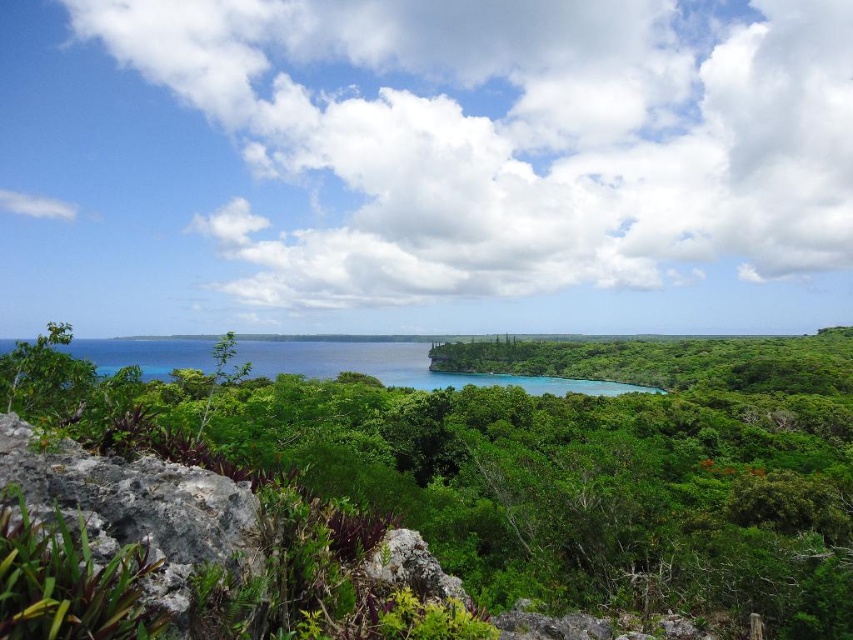
Question: Does green leafy tree at center lie in front of blue-green water at center?

Choices:
 (A) yes
 (B) no

Answer: (A)

Question: Which point appears farthest from the camera in this image?

Choices:
 (A) (50, 468)
 (B) (293, 372)

Answer: (B)

Question: Based on their relative distances, which object is nearer to the blue-green water at center?

Choices:
 (A) green leafy tree at center
 (B) gray rough rock at lower left

Answer: (A)

Question: Does gray rough rock at lower left appear on the right side of blue-green water at center?

Choices:
 (A) no
 (B) yes

Answer: (B)

Question: Which point is closer to the camera?

Choices:
 (A) (553, 456)
 (B) (389, 355)

Answer: (A)

Question: Is green leafy tree at center bigger than gray rough rock at lower left?

Choices:
 (A) no
 (B) yes

Answer: (B)